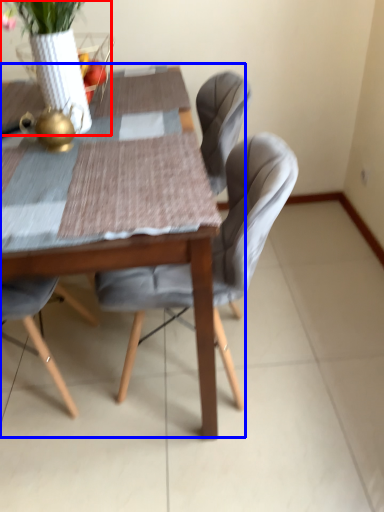
Question: Which object appears farthest to the camera in this image, floral arrangement (highlighted by a red box) or kitchen & dining room table (highlighted by a blue box)?

Choices:
 (A) floral arrangement
 (B) kitchen & dining room table

Answer: (A)